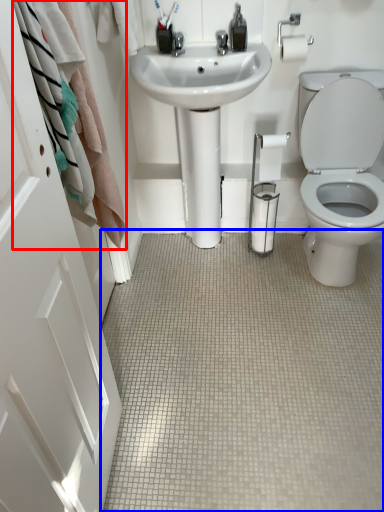
Question: Which of the following is the farthest to the observer, bath towel (highlighted by a red box) or plain (highlighted by a blue box)?

Choices:
 (A) bath towel
 (B) plain

Answer: (B)